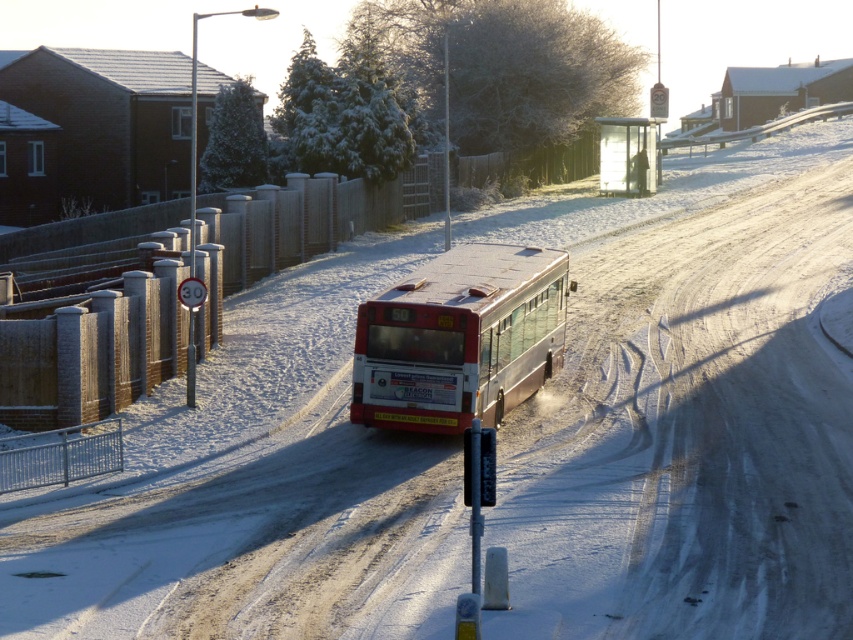
Looking at this image, you are a pedestrian waiting at the transparent plastic bus stop at center. You see the silver metallic bus at center approaching. Which side of the road is the bus coming from?

The silver metallic bus at center is to the left of the transparent plastic bus stop at center, so the bus is coming from the left side of the road.

You are standing on the snowy road and want to reach the point marked at coordinates (556, 292). Given that the bus is 100 feet long, can you safely walk around it to reach that point without entering the road? Please explain your reasoning.

The point marked at coordinates (556, 292) is 105.45 feet away from the viewer. Since the bus is only 100 feet long, the point is beyond the length of the bus. Therefore, you would need to walk around the bus to reach it, but since the bus is on the road, walking around it might require entering the road. However, the exact path isnecessary to determine safety, which isn not provided. Thus, it is not possible to safely reach the point without entering the road based on the given information.

You are a pedestrian waiting at the transparent plastic bus stop at center. The bus you need to catch is the silver metallic bus at center. The bus driver has just announced that the bus will arrive in 2 minutes. Considering the distance between you and the bus, do you think you have enough time to run to the nearest safe area if the bus suddenly stops before reaching you?

The distance between the silver metallic bus at center and the transparent plastic bus stop at center is 39.47 meters. If the bus suddenly stops, you would have approximately 2 minutes before it arrives, giving you sufficient time to run to the nearest safe area.